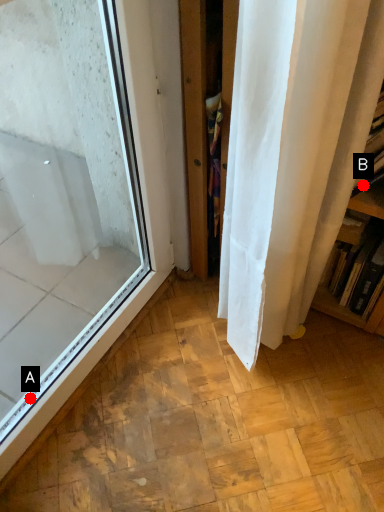
Question: Two points are circled on the image, labeled by A and B beside each circle. Which point appears farthest from the camera in this image?

Choices:
 (A) A is further
 (B) B is further

Answer: (A)